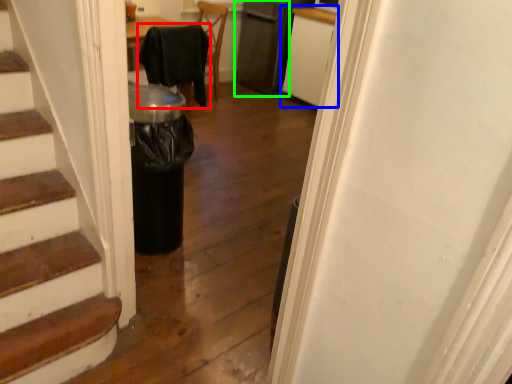
Question: Based on their relative distances, which object is nearer to chair (highlighted by a red box)? Choose from cabinetry (highlighted by a blue box) and appliance (highlighted by a green box).

Choices:
 (A) cabinetry
 (B) appliance

Answer: (A)